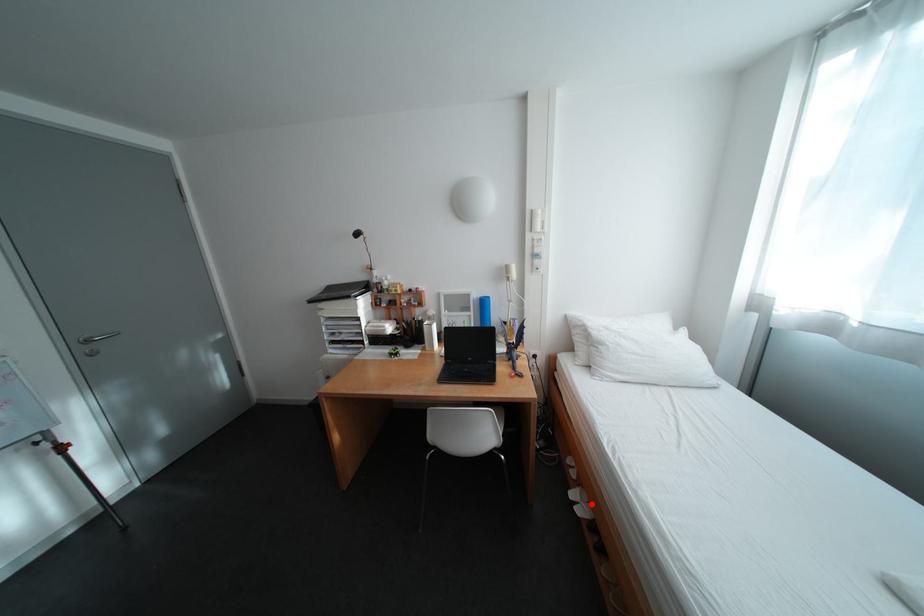
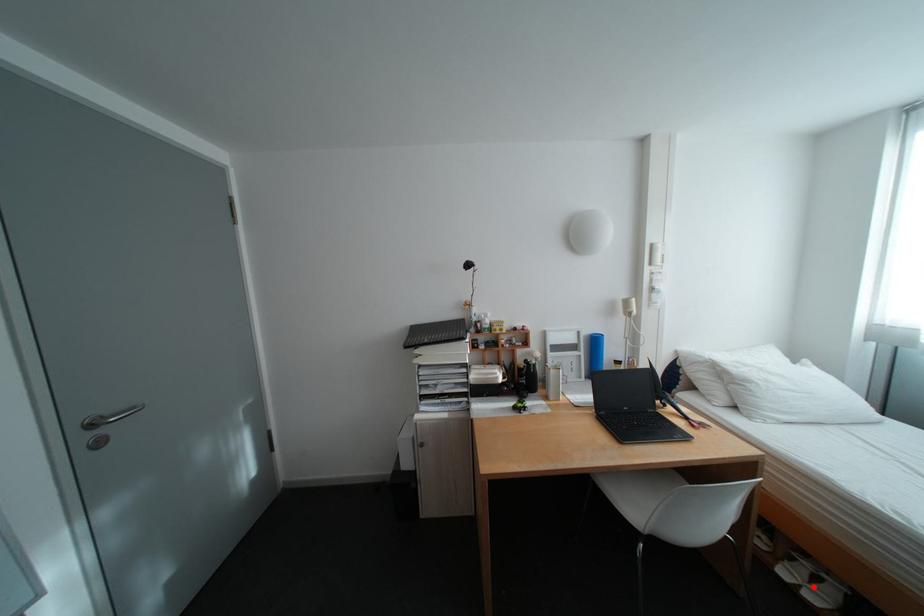
I am providing you with two images of the same scene from different viewpoints. A red point is marked on the first image and another point is marked on the second image. Is the red point in image1 aligned with the point shown in image2?

Yes